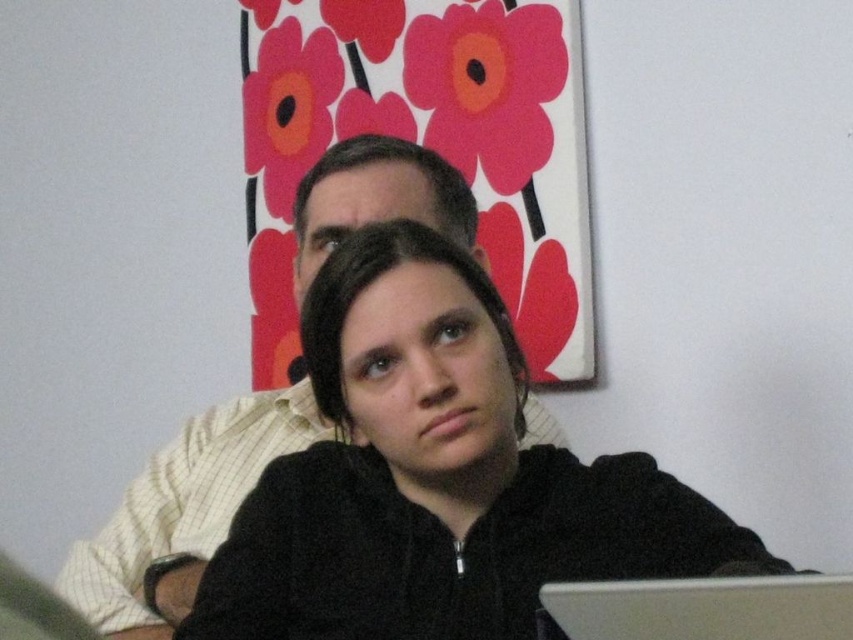
Question: Is black matte jacket at center positioned in front of silver metallic laptop at lower center?

Choices:
 (A) no
 (B) yes

Answer: (A)

Question: Which is nearer to the black matte jacket at center?

Choices:
 (A) light yellow checkered shirt at center
 (B) silver metallic laptop at lower center

Answer: (B)

Question: Estimate the real-world distances between objects in this image. Which object is closer to the silver metallic laptop at lower center?

Choices:
 (A) light yellow checkered shirt at center
 (B) black matte jacket at center

Answer: (B)

Question: Which object is farther from the camera taking this photo?

Choices:
 (A) light yellow checkered shirt at center
 (B) black matte jacket at center
 (C) silver metallic laptop at lower center

Answer: (A)

Question: Does light yellow checkered shirt at center appear over silver metallic laptop at lower center?

Choices:
 (A) yes
 (B) no

Answer: (A)

Question: Is light yellow checkered shirt at center closer to the viewer compared to silver metallic laptop at lower center?

Choices:
 (A) yes
 (B) no

Answer: (B)